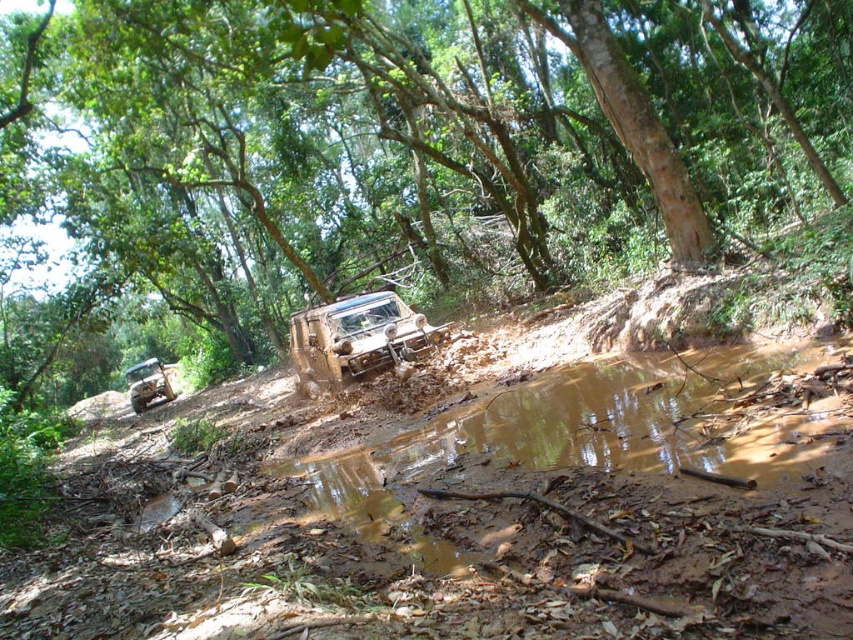
You are a hiker trying to locate a brown rough tree in the upper center of the forest scene. The GPS coordinates provided are point (409, 141). Can you confirm if this point is indeed on the brown rough tree?

Yes, the point (409, 141) is located on the brown rough tree at upper center, so the coordinates are accurate.

You are a hiker trying to navigate through the forest. You see the brown muddy dirt track at center. Based on the scene description, where would you expect this track to be located relative to the muddy puddle in the lower center?

The brown muddy dirt track at center is located at point (473, 518), which is slightly to the right and above the muddy puddle in the lower center.

You are a hiker trying to cross the muddy area in the image. There is a point marked at coordinates (473, 518). What is located at that point?

The point at coordinates (473, 518) is covered by brown muddy dirt track at center.